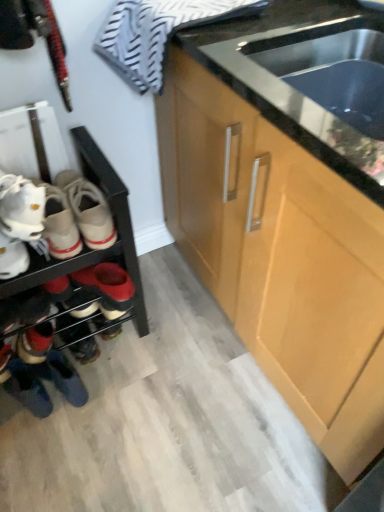
Question: Does point (16, 216) appear closer or farther from the camera than point (340, 126)?

Choices:
 (A) closer
 (B) farther

Answer: (B)

Question: From their relative heights in the image, would you say white matte shoes at left, the second footwear ordered from the bottom, is taller or shorter than stainless steel sink at center?

Choices:
 (A) tall
 (B) short

Answer: (B)

Question: Which of these objects is positioned closest to the black matte shoe rack at left?

Choices:
 (A) striped cotton towel at upper left
 (B) leather sneakers at lower left, the 1th footwear in the back-to-front sequence
 (C) white matte shoes at left, which is the 2th footwear from back to front
 (D) stainless steel sink at center
 (E) matte wood cabinet at center

Answer: (C)

Question: Which of these objects is positioned closest to the striped cotton towel at upper left?

Choices:
 (A) stainless steel sink at center
 (B) white matte shoes at left, positioned as the 1th footwear in front-to-back order
 (C) matte wood cabinet at center
 (D) black matte shoe rack at left
 (E) leather sneakers at lower left, the first footwear positioned from the bottom

Answer: (A)